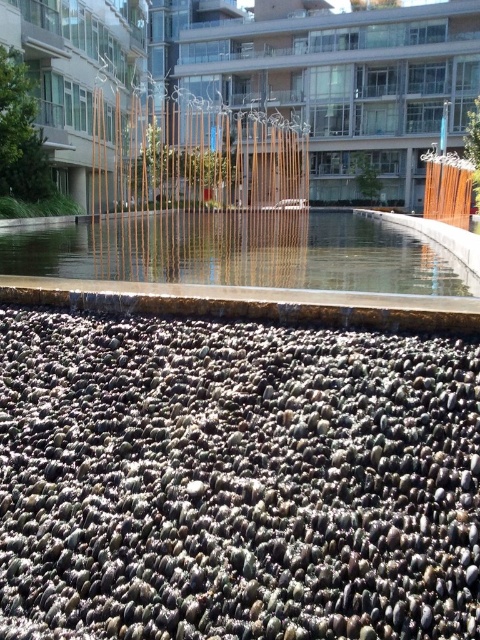
You are a landscape architect analyzing the urban space. You need to determine which object is lower in height between the black pebbles at bottom and the brown wooden fence at upper center. Based on the scene, which one is shorter?

The black pebbles at bottom is shorter than the brown wooden fence at upper center according to the description.

You are a landscape architect designing a garden and want to ensure the black pebbles at bottom and clear glass water at center are visible from above. Based on the scene, which object is lower in height and might require adjustment to be seen better?

The black pebbles at bottom has a lesser height compared to clear glass water at center, so the black pebbles at bottom are lower and might need to be raised or the water level lowered to ensure visibility.